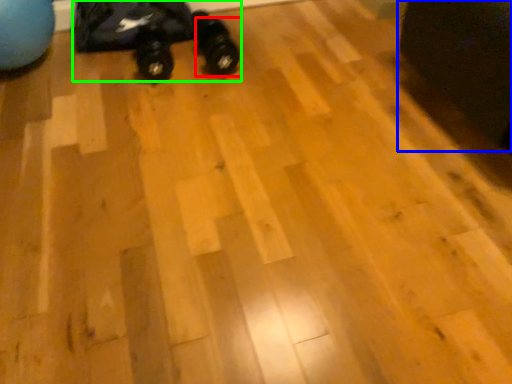
Question: Considering the real-world distances, which object is farthest from footwear (highlighted by a red box)? swivel chair (highlighted by a blue box) or toy car (highlighted by a green box)?

Choices:
 (A) swivel chair
 (B) toy car

Answer: (A)